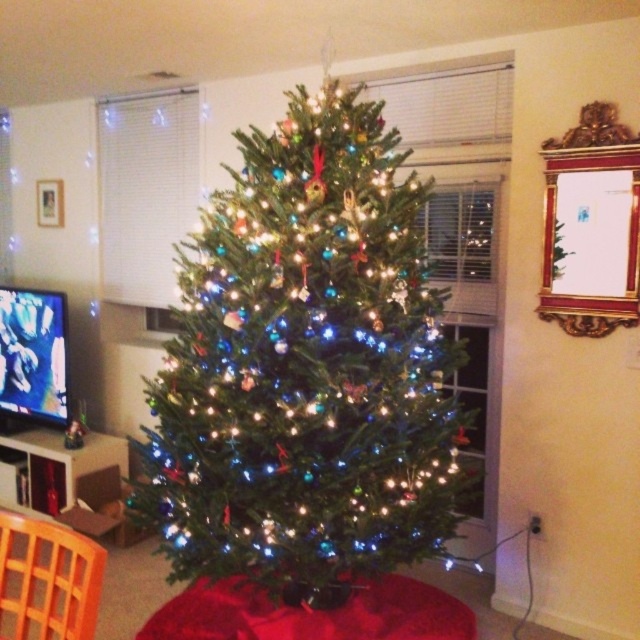
You are standing in the festive living room and want to place a gift under the green matte christmas tree at center. Based on the coordinates provided, where should you place the gift relative to the room?

The green matte christmas tree at center is located at coordinates point (305,368), so you should place the gift directly beneath this position.

You are a guest in this living room and need to sit down. You see the green matte christmas tree at center and the orange plastic chair at lower left. Which object can you sit on?

The orange plastic chair at lower left is the object you can sit on, as the green matte christmas tree at center is larger in size but not designed for sitting.

You are standing in the living room and want to place a new decoration on the green matte christmas tree at center. The point where you want to place it is at coordinates point (x=305, y=368). Is this point located on the tree?

Yes, the point (x=305, y=368) is on the green matte christmas tree at center, so the decoration can be placed there.